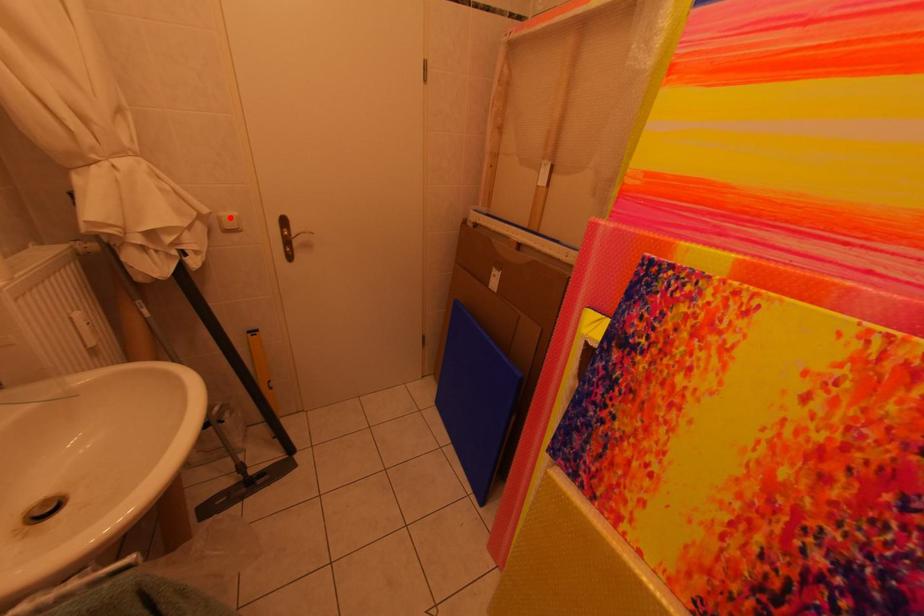
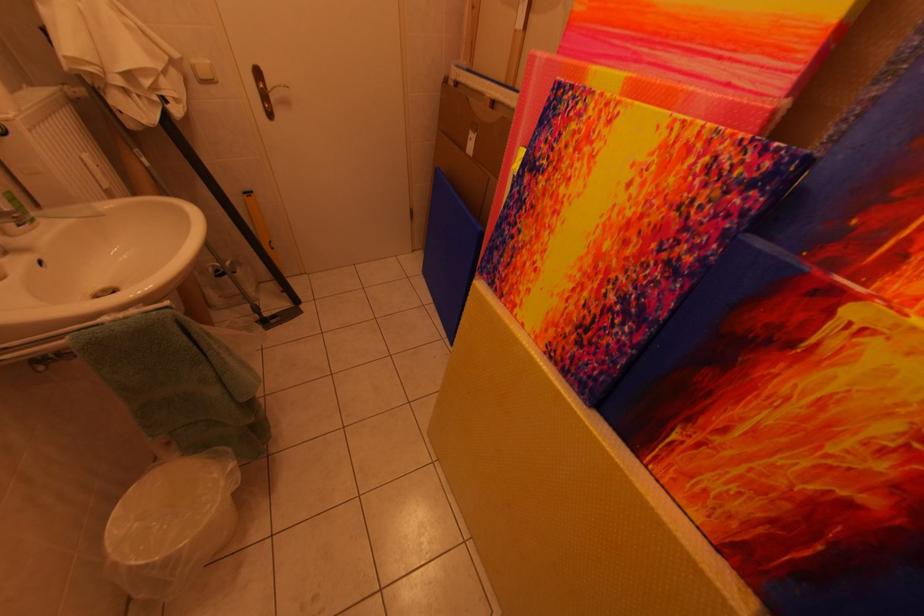
The point at the highlighted location is marked in the first image. Where is the corresponding point in the second image?

(203, 65)